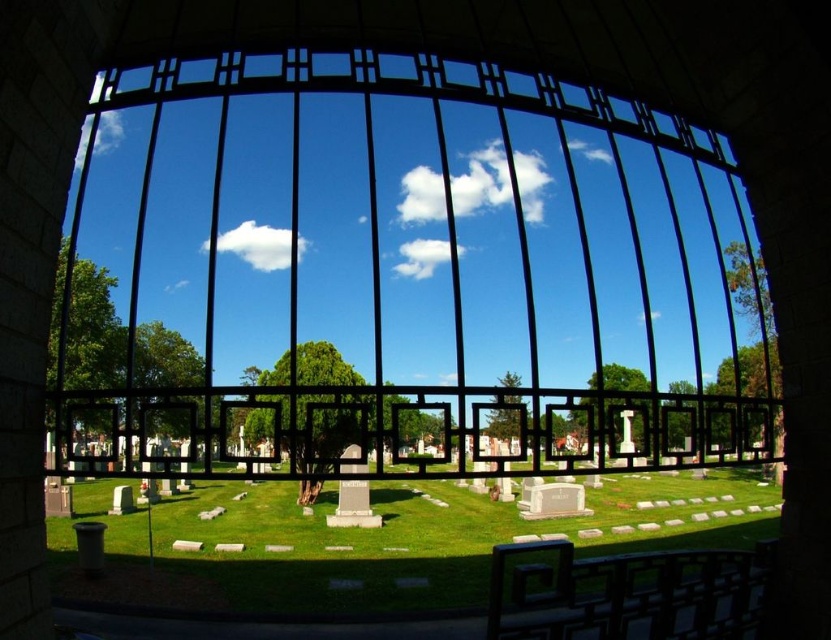
Is point (553, 340) in front of point (441, 490)?

That is True.

Describe the element at coordinates (401, 276) in the screenshot. The image size is (831, 640). I see `black metal gate at center` at that location.

Where is `black metal gate at center`? black metal gate at center is located at coordinates (401, 276).